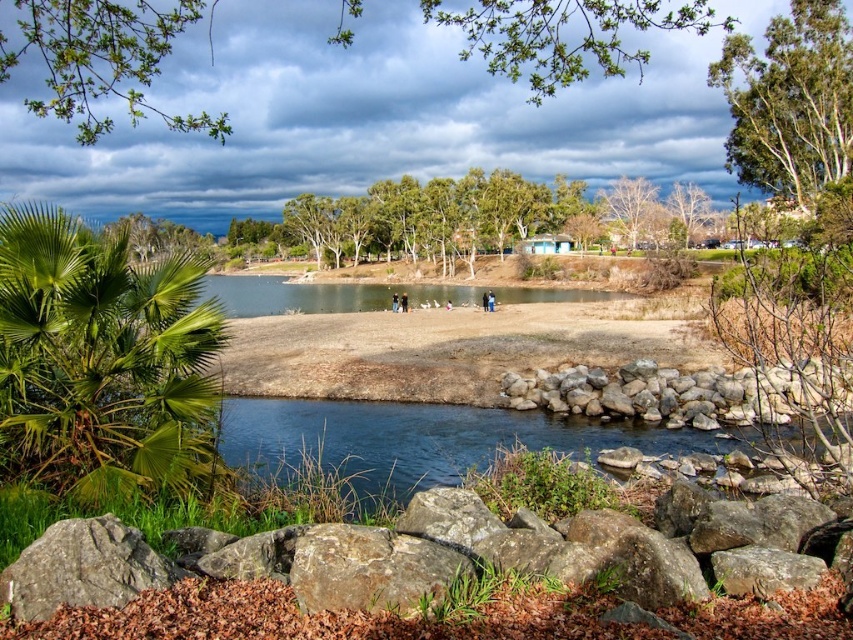
Question: From the image, what is the correct spatial relationship of green leafy palm at lower left in relation to bare wood tree at upper center?

Choices:
 (A) left
 (B) right

Answer: (A)

Question: Estimate the real-world distances between objects in this image. Which object is closer to the bare wood tree at upper center?

Choices:
 (A) bare branches at upper center
 (B) brown rough rock at lower left
 (C) green leafy palm at lower left

Answer: (A)

Question: Among these points, which one is nearest to the camera?

Choices:
 (A) (741, 81)
 (B) (100, 257)
 (C) (106, 70)

Answer: (B)

Question: Is brown rough rock at lower left to the right of bare wood tree at upper center from the viewer's perspective?

Choices:
 (A) no
 (B) yes

Answer: (A)

Question: Is green leafy tree at upper right smaller than brown rough rock at lower left?

Choices:
 (A) no
 (B) yes

Answer: (A)

Question: Which object is positioned closest to the gray rock wall at lower center?

Choices:
 (A) green leafy branches at upper center
 (B) bare branches at upper center

Answer: (A)